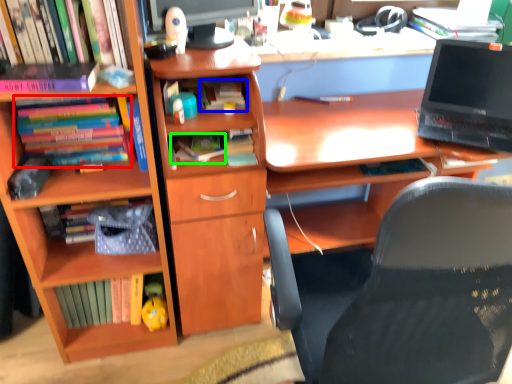
Question: Considering the real-world distances, which object is closest to book (highlighted by a red box)? book (highlighted by a blue box) or book (highlighted by a green box).

Choices:
 (A) book
 (B) book

Answer: (B)